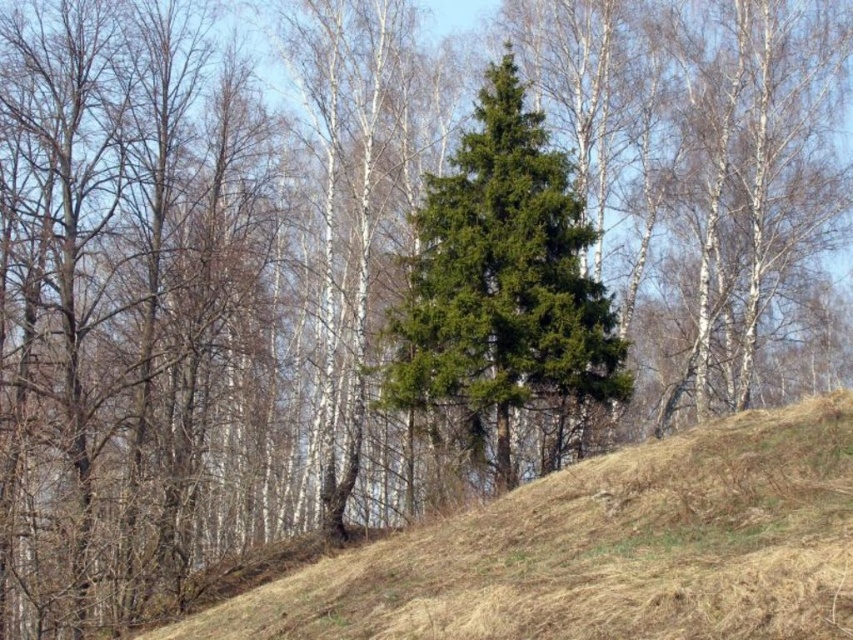
You are standing at the center of the image and want to walk to the brown grassy hillside at lower left. Which direction should you face to head directly towards it?

To reach the brown grassy hillside at lower left, you should face towards the lower left direction since it is located at point (602, 550).